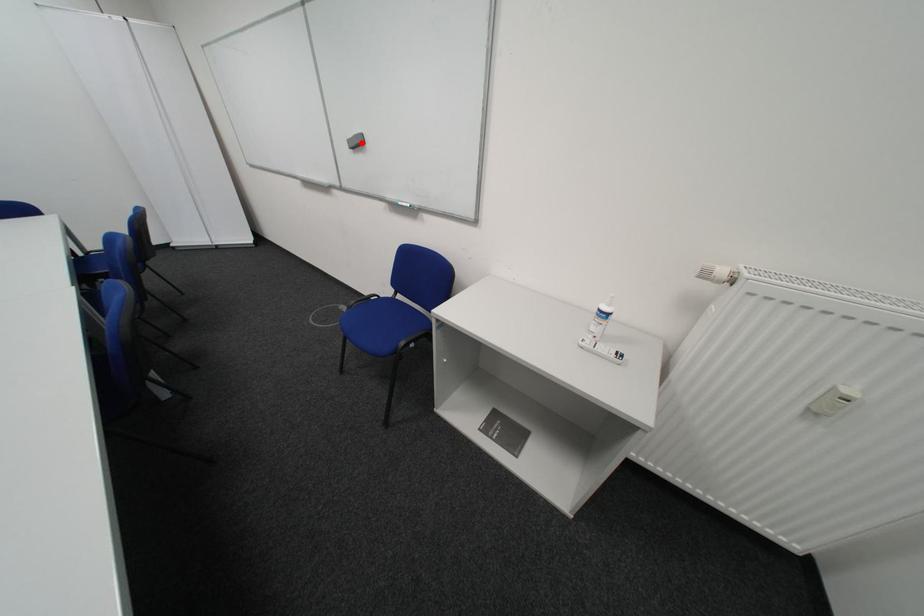
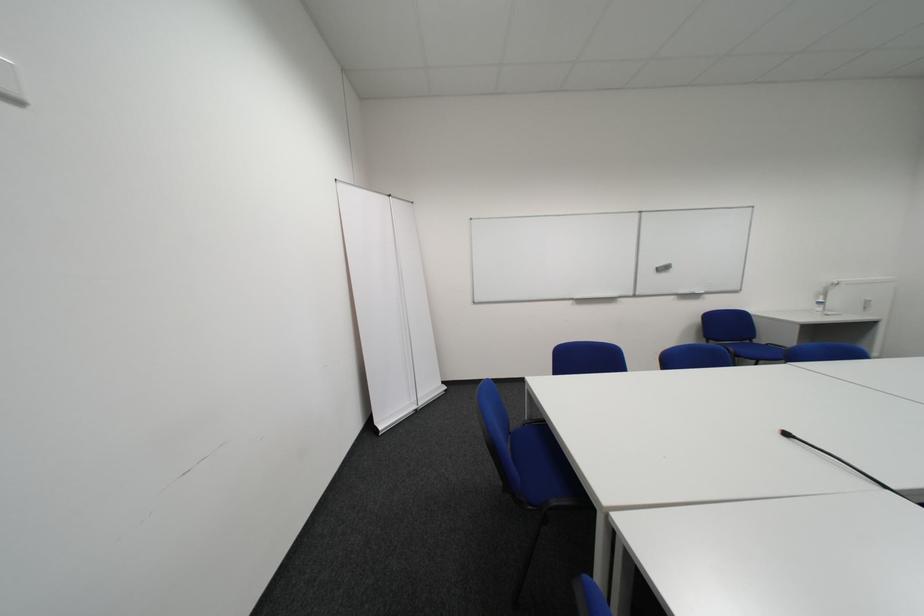
Find the pixel in the second image that matches the highlighted location in the first image.

(669, 270)